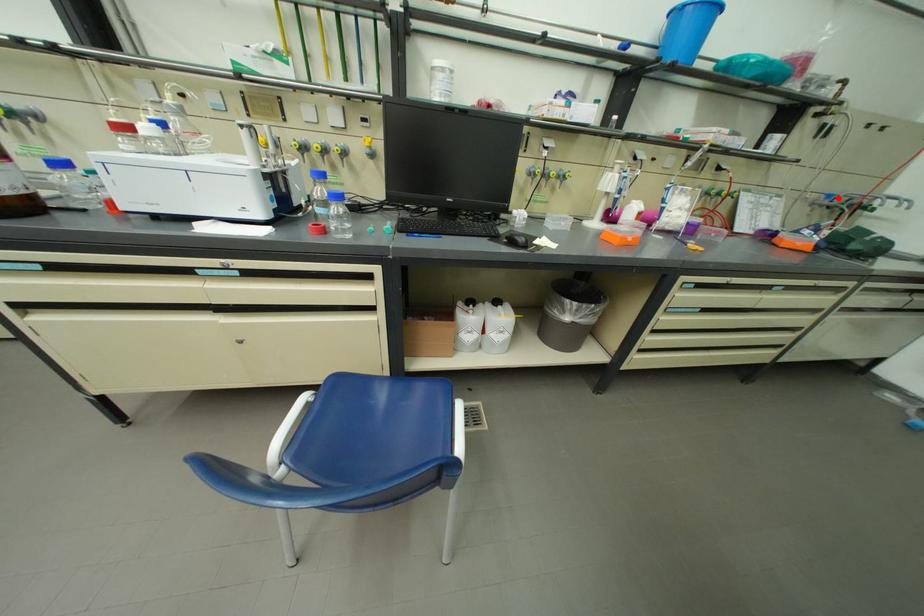
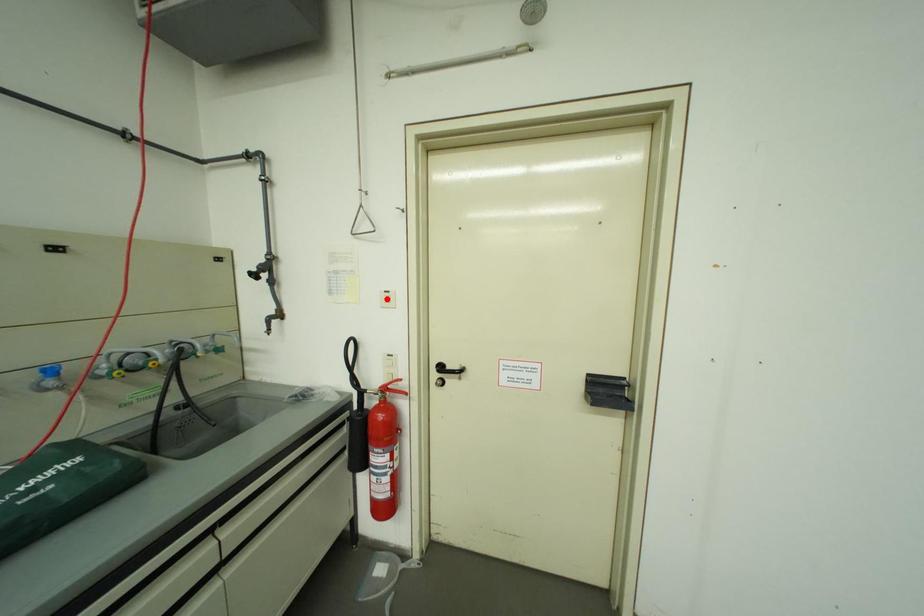
I am providing you with two images of the same scene from different viewpoints. A red point is marked on the first image and another point is marked on the second image. Is the marked point in image1 the same physical position as the marked point in image2?

No